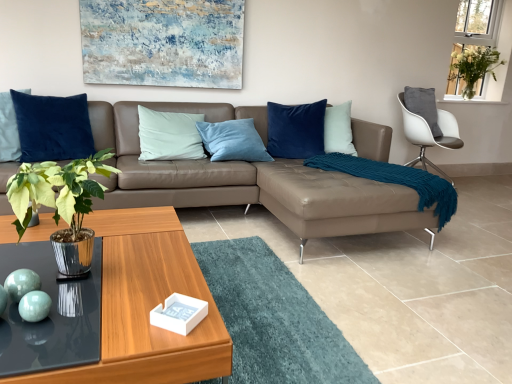
What do you see at coordinates (249, 179) in the screenshot?
I see `brown leather couch at center` at bounding box center [249, 179].

Where is `brown leather couch at center`? The width and height of the screenshot is (512, 384). brown leather couch at center is located at coordinates (249, 179).

I want to click on white fabric chair at upper right, so click(430, 135).

What do you see at coordinates (477, 24) in the screenshot? I see `white glass vase at upper right` at bounding box center [477, 24].

From the picture: Measure the distance between point (x=497, y=65) and camera.

Point (x=497, y=65) and camera are 4.47 meters apart.

Image resolution: width=512 pixels, height=384 pixels. Describe the element at coordinates (473, 67) in the screenshot. I see `green leafy plant at upper right` at that location.

Locate an element on the screen. brown leather couch at center is located at coordinates (249, 179).

Which is less distant, (x=58, y=176) or (x=472, y=91)?

Point (x=58, y=176) is positioned closer to the camera compared to point (x=472, y=91).

Is shiny metallic plant at center-left next to green leafy plant at upper right?

shiny metallic plant at center-left and green leafy plant at upper right are clearly separated.

From the picture: Which is more to the left, shiny metallic plant at center-left or green leafy plant at upper right?

shiny metallic plant at center-left.

There is a shiny metallic plant at center-left. Identify the location of plant above it (from a real-world perspective). Image resolution: width=512 pixels, height=384 pixels. (473, 67).

Is teal glossy spheres at lower left, marked as the 2th teal in a right-to-left arrangement, not within wooden glossy coffee table at lower left?

Yes, teal glossy spheres at lower left, marked as the 2th teal in a right-to-left arrangement, is located beyond the bounds of wooden glossy coffee table at lower left.

From the image's perspective, between teal glossy spheres at lower left, the first teal in the left-to-right sequence, and wooden glossy coffee table at lower left, which one is located above?

teal glossy spheres at lower left, the first teal in the left-to-right sequence, appears higher in the image.

Is teal glossy spheres at lower left, marked as the 2th teal in a right-to-left arrangement, at the right side of wooden glossy coffee table at lower left?

In fact, teal glossy spheres at lower left, marked as the 2th teal in a right-to-left arrangement, is to the left of wooden glossy coffee table at lower left.

Is point (409, 118) behind point (477, 57)?

That is False.

Is white fabric chair at upper right turned away from green leafy plant at upper right?

white fabric chair at upper right does not have its back to green leafy plant at upper right.

Would you say white fabric chair at upper right is a long distance from green leafy plant at upper right?

No.

From a real-world perspective, is white fabric chair at upper right physically above green leafy plant at upper right?

No, from a real-world perspective, white fabric chair at upper right is not over green leafy plant at upper right

You are a GUI agent. You are given a task and a screenshot of the screen. Output one action in this format:
    pyautogui.click(x=<x>, y=<y>)
    Task: Click on the coffee table below the green leafy plant at upper right (from a real-world perspective)
    This screenshot has height=384, width=512.
    Given the screenshot: What is the action you would take?
    pyautogui.click(x=147, y=306)

Between wooden glossy coffee table at lower left and green leafy plant at upper right, which one has smaller size?

Smaller between the two is green leafy plant at upper right.

Looking at this image, what's the angular difference between wooden glossy coffee table at lower left and green leafy plant at upper right's facing directions?

The facing directions of wooden glossy coffee table at lower left and green leafy plant at upper right are 94.1 degrees apart.

From the image's perspective, is wooden glossy coffee table at lower left below green leafy plant at upper right?

Yes.

Considering the relative positions of green leafy plant at upper right and shiny metallic plant at center-left in the image provided, is green leafy plant at upper right to the left of shiny metallic plant at center-left from the viewer's perspective?

In fact, green leafy plant at upper right is to the right of shiny metallic plant at center-left.

Is shiny metallic plant at center-left completely or partially inside green leafy plant at upper right?

That's incorrect, shiny metallic plant at center-left is not inside green leafy plant at upper right.

Does green leafy plant at upper right touch shiny metallic plant at center-left?

green leafy plant at upper right and shiny metallic plant at center-left are not in contact.

Between point (451, 59) and point (71, 192), which one is positioned behind?

The point (451, 59) is more distant.

Where is `window screen above the white fabric chair at upper right (from a real-world perspective)`? The image size is (512, 384). window screen above the white fabric chair at upper right (from a real-world perspective) is located at coordinates (477, 24).

Are white fabric chair at upper right and white glass vase at upper right located far from each other?

Yes, white fabric chair at upper right and white glass vase at upper right are located far from each other.

Is white fabric chair at upper right completely or partially outside of white glass vase at upper right?

Indeed, white fabric chair at upper right is completely outside white glass vase at upper right.

Which object is positioned more to the right, brown leather couch at center or white fabric chair at upper right?

white fabric chair at upper right is more to the right.

Is brown leather couch at center bigger than white fabric chair at upper right?

Yes.

Which object is further away from the camera taking this photo, brown leather couch at center or white fabric chair at upper right?

Positioned behind is white fabric chair at upper right.

Would you consider brown leather couch at center to be distant from white fabric chair at upper right?

Indeed, brown leather couch at center is not near white fabric chair at upper right.

This screenshot has width=512, height=384. Identify the location of plant on the right side of shiny metallic plant at center-left. (473, 67).

Locate an element on the screen. This screenshot has width=512, height=384. coffee table below the teal glossy spheres at lower left, marked as the 2th teal in a right-to-left arrangement (from the image's perspective) is located at coordinates (147, 306).

From the image, which object appears to be nearer to transparent glass table at lower left, green leafy plant at upper right or teal glossy sphere at lower left, placed as the second teal when sorted from left to right?

teal glossy sphere at lower left, placed as the second teal when sorted from left to right, is positioned closer to the anchor transparent glass table at lower left.

Which object lies further to the anchor point wooden glossy coffee table at lower left, teal glossy spheres at lower left, the first teal in the left-to-right sequence, or shiny metallic plant at center-left?

teal glossy spheres at lower left, the first teal in the left-to-right sequence, is further to wooden glossy coffee table at lower left.

Which object lies further to the anchor point white glass vase at upper right, teal glossy sphere at lower left, placed as the second teal when sorted from left to right, or brown leather couch at center?

teal glossy sphere at lower left, placed as the second teal when sorted from left to right.

Considering their positions, is teal glossy sphere at lower left, which appears as the first teal when viewed from the right, positioned further to teal knitted blanket at right than shiny metallic plant at center-left?

teal glossy sphere at lower left, which appears as the first teal when viewed from the right, is positioned further to the anchor teal knitted blanket at right.

From the image, which object appears to be nearer to teal knitted blanket at right, wooden glossy coffee table at lower left or teal glossy spheres at lower left, the first teal in the left-to-right sequence?

wooden glossy coffee table at lower left is closer to teal knitted blanket at right.

Estimate the real-world distances between objects in this image. Which object is further from teal knitted blanket at right, shiny metallic plant at center-left or wooden glossy coffee table at lower left?

Among the two, shiny metallic plant at center-left is located further to teal knitted blanket at right.

Estimate the real-world distances between objects in this image. Which object is further from teal knitted blanket at right, green leafy plant at upper right or teal glossy spheres at lower left, the first teal in the left-to-right sequence?

The object further to teal knitted blanket at right is green leafy plant at upper right.

From the image, which object appears to be nearer to teal knitted blanket at right, teal glossy spheres at lower left, the first teal in the left-to-right sequence, or shiny metallic plant at center-left?

shiny metallic plant at center-left is closer to teal knitted blanket at right.

Where is `plant between teal glossy sphere at lower left, which appears as the first teal when viewed from the right, and white glass vase at upper right in the front-back direction`? This screenshot has height=384, width=512. plant between teal glossy sphere at lower left, which appears as the first teal when viewed from the right, and white glass vase at upper right in the front-back direction is located at coordinates (473, 67).

At what (x,y) coordinates should I click in order to perform the action: click on houseplant between transparent glass table at lower left and green leafy plant at upper right from front to back. Please return your answer as a coordinate pair (x, y). The height and width of the screenshot is (384, 512). Looking at the image, I should click on (62, 204).

You are a GUI agent. You are given a task and a screenshot of the screen. Output one action in this format:
    pyautogui.click(x=<x>, y=<y>)
    Task: Click on the houseplant located between transparent glass table at lower left and white glass vase at upper right in the depth direction
    
    Given the screenshot: What is the action you would take?
    pyautogui.click(x=62, y=204)

Find the location of a particular element. The height and width of the screenshot is (384, 512). studio couch between teal glossy sphere at lower left, which appears as the first teal when viewed from the right, and teal knitted blanket at right, in the horizontal direction is located at coordinates (249, 179).